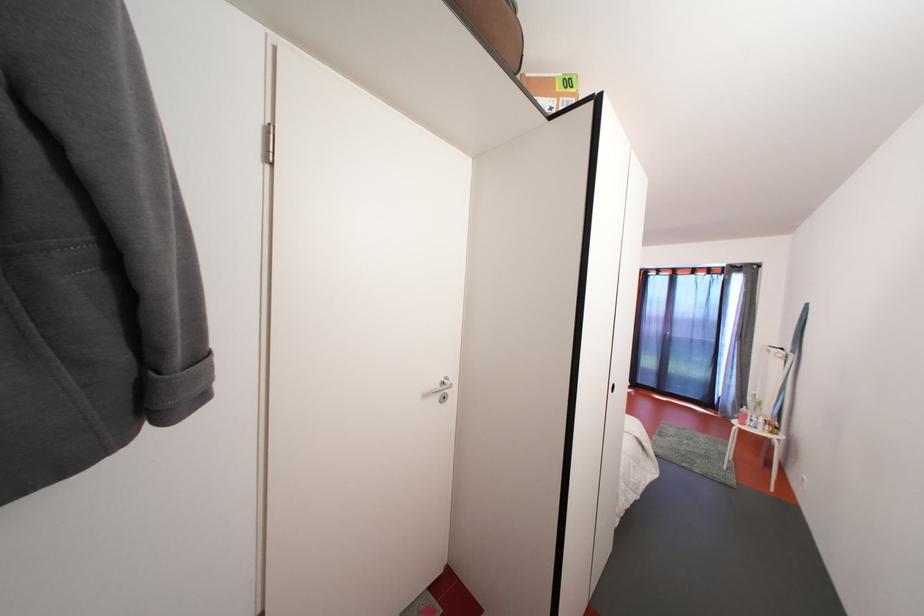
The width and height of the screenshot is (924, 616). What do you see at coordinates (441, 390) in the screenshot?
I see `the silver door handle` at bounding box center [441, 390].